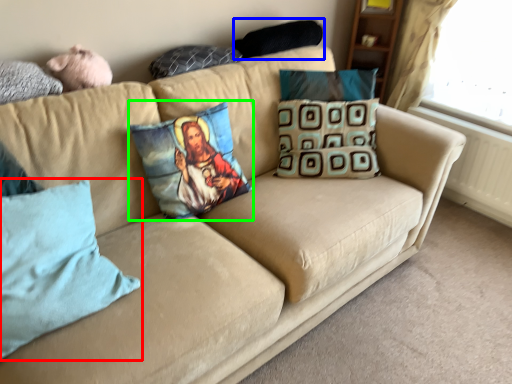
Question: Considering the real-world distances, which object is closest to pillow (highlighted by a red box)? pillow (highlighted by a blue box) or pillow (highlighted by a green box).

Choices:
 (A) pillow
 (B) pillow

Answer: (B)